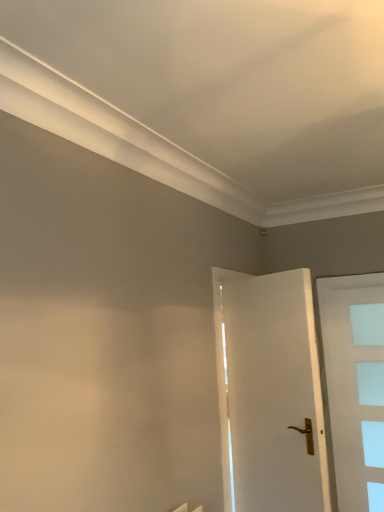
Question: Is white frosted glass door at right, which is counted as the second door, starting from the left, taller or shorter than white glossy door at center, placed as the first door when sorted from left to right?

Choices:
 (A) short
 (B) tall

Answer: (B)

Question: Is white frosted glass door at right, which is counted as the second door, starting from the left, in front of or behind white glossy door at center, which ranks as the 1th door in front-to-back order, in the image?

Choices:
 (A) front
 (B) behind

Answer: (B)

Question: Does point (367, 420) appear closer or farther from the camera than point (309, 304)?

Choices:
 (A) farther
 (B) closer

Answer: (A)

Question: Considering the positions of white glossy door at center, which ranks as the 1th door in front-to-back order, and white frosted glass door at right, which is counted as the second door, starting from the left, in the image, is white glossy door at center, which ranks as the 1th door in front-to-back order, wider or thinner than white frosted glass door at right, which is counted as the second door, starting from the left,?

Choices:
 (A) wide
 (B) thin

Answer: (A)

Question: Is white glossy door at center, positioned as the second door in back-to-front order, bigger or smaller than white frosted glass door at right, marked as the 2th door in a front-to-back arrangement?

Choices:
 (A) small
 (B) big

Answer: (B)

Question: From their relative heights in the image, would you say white glossy door at center, which ranks as the 1th door in front-to-back order, is taller or shorter than white frosted glass door at right, marked as the 2th door in a front-to-back arrangement?

Choices:
 (A) tall
 (B) short

Answer: (B)

Question: From the image's perspective, is white glossy door at center, placed as the first door when sorted from left to right, located above or below white frosted glass door at right, which is counted as the second door, starting from the left?

Choices:
 (A) above
 (B) below

Answer: (A)